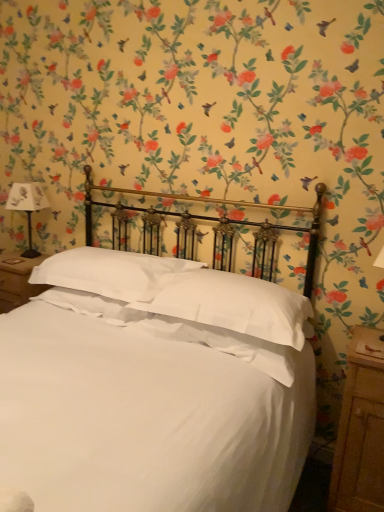
What is the approximate height of white paper lampshade at left?

white paper lampshade at left is 18.59 inches in height.

In order to face wooden nightstand at right, should I rotate leftwards or rightwards?

Rotate right and turn 22.445 degrees.

The image size is (384, 512). Describe the element at coordinates (112, 273) in the screenshot. I see `white soft pillow at center, positioned as the second pillow in right-to-left order` at that location.

This screenshot has height=512, width=384. In order to click on white paper lampshade at left in this screenshot , I will do click(27, 207).

Considering the relative sizes of white satin bed at center and wooden nightstand at right in the image provided, is white satin bed at center bigger than wooden nightstand at right?

Yes, white satin bed at center is bigger than wooden nightstand at right.

Is wooden nightstand at right completely or partially inside white satin bed at center?

Indeed, wooden nightstand at right is located within white satin bed at center.

From the picture: How different are the orientations of white satin bed at center and wooden nightstand at right in degrees?

They differ by 2.19 degrees in their facing directions.

Is white satin bed at center wider than wooden nightstand at right?

Indeed, white satin bed at center has a greater width compared to wooden nightstand at right.

Locate an element on the screen. Image resolution: width=384 pixels, height=512 pixels. the 1st pillow to the right when counting from the white paper lampshade at left is located at coordinates (112, 273).

Would you say white soft pillow at center, positioned as the second pillow in right-to-left order, is to the left or to the right of white paper lampshade at left in the picture?

In the image, white soft pillow at center, positioned as the second pillow in right-to-left order, appears on the right side of white paper lampshade at left.

From their relative heights in the image, would you say white soft pillow at center, positioned as the second pillow in right-to-left order, is taller or shorter than white paper lampshade at left?

Considering their sizes, white soft pillow at center, positioned as the second pillow in right-to-left order, has less height than white paper lampshade at left.

From a real-world perspective, which is physically below, white soft pillow at center, which ranks as the first pillow in left-to-right order, or white paper lampshade at left?

white soft pillow at center, which ranks as the first pillow in left-to-right order, from a real-world perspective.

Consider the image. Is wooden nightstand at right to the left of white satin bed at center from the viewer's perspective?

No.

From a real-world perspective, is wooden nightstand at right located beneath white satin bed at center?

Yes, from a real-world perspective, wooden nightstand at right is under white satin bed at center.

Would you say white satin bed at center is part of wooden nightstand at right's contents?

No.

Is wooden nightstand at right not near white satin bed at center?

No, wooden nightstand at right is not far away from white satin bed at center.

Can you confirm if white soft pillow at center, which ranks as the first pillow in left-to-right order, is bigger than white soft pillow at center, which is counted as the 2th pillow, starting from the left?

Indeed, white soft pillow at center, which ranks as the first pillow in left-to-right order, has a larger size compared to white soft pillow at center, which is counted as the 2th pillow, starting from the left.

Which is in front, point (121, 264) or point (288, 323)?

The point (288, 323) is in front.

Find the location of `pillow below the white soft pillow at center, which is counted as the 2th pillow, starting from the left (from a real-world perspective)`. pillow below the white soft pillow at center, which is counted as the 2th pillow, starting from the left (from a real-world perspective) is located at coordinates (112, 273).

Where is `nightstand that appears in front of the white soft pillow at center, which is counted as the 2th pillow, starting from the left`? nightstand that appears in front of the white soft pillow at center, which is counted as the 2th pillow, starting from the left is located at coordinates (361, 429).

Are white soft pillow at center, which is counted as the 2th pillow, starting from the left, and wooden nightstand at right far apart?

That's not correct — white soft pillow at center, which is counted as the 2th pillow, starting from the left, is a little close to wooden nightstand at right.

Can wooden nightstand at right be found inside white soft pillow at center, which is counted as the 2th pillow, starting from the left?

No, white soft pillow at center, which is counted as the 2th pillow, starting from the left, does not contain wooden nightstand at right.

Is white paper lampshade at left situated inside white satin bed at center or outside?

white paper lampshade at left cannot be found inside white satin bed at center.

Based on their positions, is white paper lampshade at left located to the left or right of white satin bed at center?

In the image, white paper lampshade at left appears on the left side of white satin bed at center.

In the image, there is a white satin bed at center. Identify the location of bedside lamp above it (from the image's perspective). (27, 207).

Looking at this image, would you consider white paper lampshade at left to be distant from white satin bed at center?

white paper lampshade at left is positioned a significant distance from white satin bed at center.

Can you see white soft pillow at center, which ranks as the 1th pillow in right-to-left order, touching white satin bed at center?

No, white soft pillow at center, which ranks as the 1th pillow in right-to-left order, is not making contact with white satin bed at center.

You are a GUI agent. You are given a task and a screenshot of the screen. Output one action in this format:
    pyautogui.click(x=<x>, y=<y>)
    Task: Click on the bed in front of the white soft pillow at center, which is counted as the 2th pillow, starting from the left
    The height and width of the screenshot is (512, 384).
    Given the screenshot: What is the action you would take?
    pyautogui.click(x=155, y=384)

Is white soft pillow at center, which ranks as the 1th pillow in right-to-left order, turned away from white satin bed at center?

Yes, white soft pillow at center, which ranks as the 1th pillow in right-to-left order,'s orientation is away from white satin bed at center.

Identify the location of bed above the wooden nightstand at right (from a real-world perspective). The width and height of the screenshot is (384, 512). (155, 384).

At what (x,y) coordinates should I click in order to perform the action: click on pillow that is the 2nd object directly below the white paper lampshade at left (from a real-world perspective). Please return your answer as a coordinate pair (x, y). The height and width of the screenshot is (512, 384). Looking at the image, I should click on (112, 273).

Looking at the image, which one is located further to white satin bed at center, white soft pillow at center, which ranks as the first pillow in left-to-right order, or wooden nightstand at right?

Based on the image, wooden nightstand at right appears to be further to white satin bed at center.

From the image, which object appears to be farther from white satin bed at center, white soft pillow at center, positioned as the second pillow in right-to-left order, or white paper lampshade at left?

The object further to white satin bed at center is white paper lampshade at left.

When comparing their distances from white soft pillow at center, positioned as the second pillow in right-to-left order, does white soft pillow at center, which ranks as the 1th pillow in right-to-left order, or wooden nightstand at right seem closer?

white soft pillow at center, which ranks as the 1th pillow in right-to-left order, is positioned closer to the anchor white soft pillow at center, positioned as the second pillow in right-to-left order.

Which object lies nearer to the anchor point white paper lampshade at left, white soft pillow at center, which ranks as the 1th pillow in right-to-left order, or wooden nightstand at right?

white soft pillow at center, which ranks as the 1th pillow in right-to-left order.

From the image, which object appears to be farther from wooden nightstand at right, white soft pillow at center, which ranks as the first pillow in left-to-right order, or white paper lampshade at left?

The object further to wooden nightstand at right is white paper lampshade at left.

Which object lies further to the anchor point wooden nightstand at right, white soft pillow at center, positioned as the second pillow in right-to-left order, or white soft pillow at center, which is counted as the 2th pillow, starting from the left?

The object further to wooden nightstand at right is white soft pillow at center, positioned as the second pillow in right-to-left order.

From the image, which object appears to be nearer to wooden nightstand at right, white satin bed at center or white soft pillow at center, positioned as the second pillow in right-to-left order?

white satin bed at center is positioned closer to the anchor wooden nightstand at right.

Which object lies further to the anchor point wooden nightstand at right, white satin bed at center or white soft pillow at center, which is counted as the 2th pillow, starting from the left?

→ white satin bed at center is further to wooden nightstand at right.

I want to click on nightstand located between white satin bed at center and white soft pillow at center, which ranks as the first pillow in left-to-right order, in the depth direction, so click(361, 429).

I want to click on nightstand located between white satin bed at center and white soft pillow at center, which ranks as the 1th pillow in right-to-left order, in the depth direction, so click(x=361, y=429).

You are a GUI agent. You are given a task and a screenshot of the screen. Output one action in this format:
    pyautogui.click(x=<x>, y=<y>)
    Task: Click on the pillow between white satin bed at center and white soft pillow at center, positioned as the second pillow in right-to-left order, along the z-axis
    
    Given the screenshot: What is the action you would take?
    pyautogui.click(x=232, y=304)

Image resolution: width=384 pixels, height=512 pixels. Find the location of `pillow located between white soft pillow at center, which ranks as the first pillow in left-to-right order, and wooden nightstand at right in the left-right direction`. pillow located between white soft pillow at center, which ranks as the first pillow in left-to-right order, and wooden nightstand at right in the left-right direction is located at coordinates (232, 304).